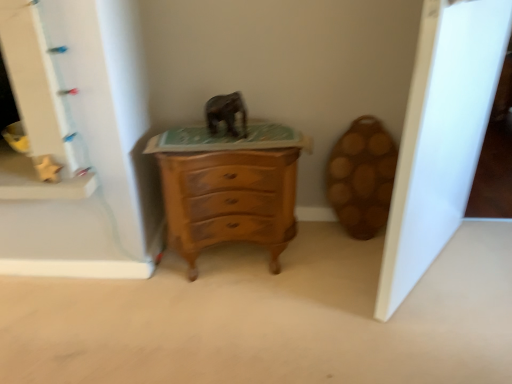
Locate an element on the screen. Image resolution: width=512 pixels, height=384 pixels. vacant space situated on the left part of matte gray elephant at center is located at coordinates 181,136.